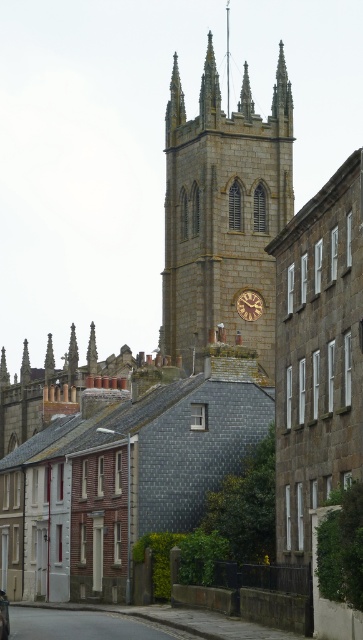
You are an architect analyzing the street scene. You notice the stone clock tower at center and the brown stone clock at center. Which of these two structures has a greater width according to the scene?

The stone clock tower at center has a greater width than the brown stone clock at center as stated in the description.

You are standing at point A, which is at coordinates (222, 212). What is the nearest object to you?

The nearest object to you at point A is the stone clock tower at center.

You are standing on the street looking at the historic stone church tower in the background and the brown stone clock at center. Based on their positions, which object is closer to the center of the image?

The brown stone clock at center is exactly at the center of the image, so it is closer to the center than the historic stone church tower in the background.